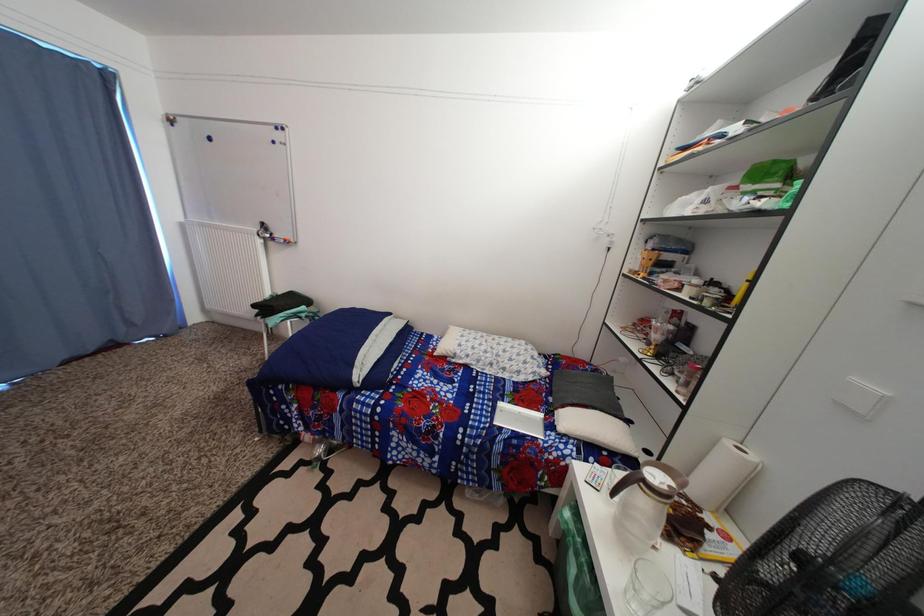
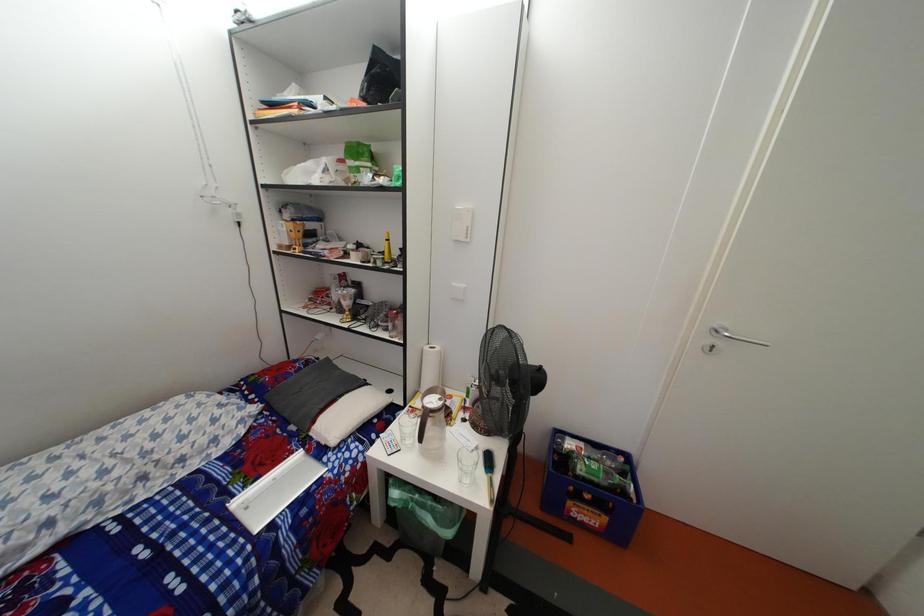
First-person continuous shooting, in which direction is the camera rotating?

The camera's rotation is toward right-down.